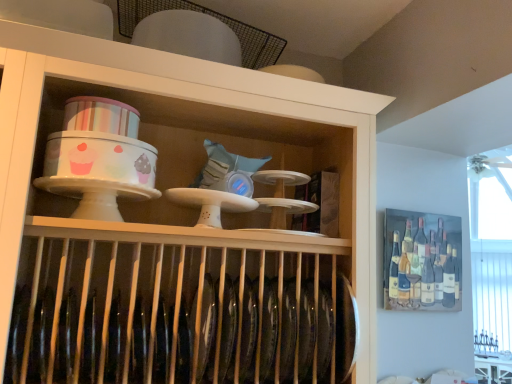
Question: Would you say white glossy table at lower right is part of white glossy cake stand at upper center's contents?

Choices:
 (A) yes
 (B) no

Answer: (B)

Question: Is the surface of white glossy cake stand at upper center in direct contact with white glossy table at lower right?

Choices:
 (A) yes
 (B) no

Answer: (B)

Question: Is white glossy cake stand at upper center at the right side of white glossy table at lower right?

Choices:
 (A) yes
 (B) no

Answer: (B)

Question: Is white glossy cake stand at upper center not inside white glossy table at lower right?

Choices:
 (A) yes
 (B) no

Answer: (A)

Question: Is white glossy cake stand at upper center bigger than white glossy table at lower right?

Choices:
 (A) yes
 (B) no

Answer: (A)

Question: Is white glossy table at lower right at the back of white glossy cake stand at upper center?

Choices:
 (A) no
 (B) yes

Answer: (A)

Question: Is white glossy cake stand at upper center to the left of painted wooden wine rack at upper right from the viewer's perspective?

Choices:
 (A) no
 (B) yes

Answer: (B)

Question: From the image's perspective, is white glossy cake stand at upper center beneath painted wooden wine rack at upper right?

Choices:
 (A) yes
 (B) no

Answer: (B)

Question: From the image's perspective, is white glossy cake stand at upper center over painted wooden wine rack at upper right?

Choices:
 (A) no
 (B) yes

Answer: (B)

Question: Does white glossy cake stand at upper center have a greater height compared to painted wooden wine rack at upper right?

Choices:
 (A) yes
 (B) no

Answer: (A)

Question: Considering the relative sizes of white glossy cake stand at upper center and painted wooden wine rack at upper right in the image provided, is white glossy cake stand at upper center smaller than painted wooden wine rack at upper right?

Choices:
 (A) no
 (B) yes

Answer: (A)

Question: Does white glossy cake stand at upper center have a greater width compared to painted wooden wine rack at upper right?

Choices:
 (A) no
 (B) yes

Answer: (B)

Question: Is painted wooden wine rack at upper right located outside white glossy table at lower right?

Choices:
 (A) yes
 (B) no

Answer: (A)